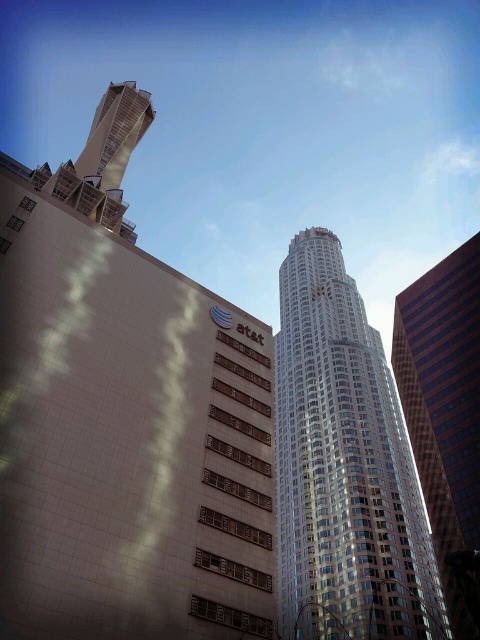
You are a city planner analyzing the skyline. You need to determine which building has a greater horizontal spread. Based on the scene, which building is wider between the silver glass skyscraper at center and the glassy reflective skyscraper at right?

The silver glass skyscraper at center is wider than the glassy reflective skyscraper at right, as its width surpasses the other building.

You are an architect evaluating two skyscrapers in the city. The silver glass skyscraper at center and the glassy reflective skyscraper at right. Which one is taller?

The silver glass skyscraper at center is taller than the glassy reflective skyscraper at right.

You are standing in front of the beige ATandT building and want to determine the relative positions of two points marked on the facade. Which point is closer to you, point (373, 561) or point (396, 369)?

Point (373, 561) is closer to the viewer than point (396, 369).